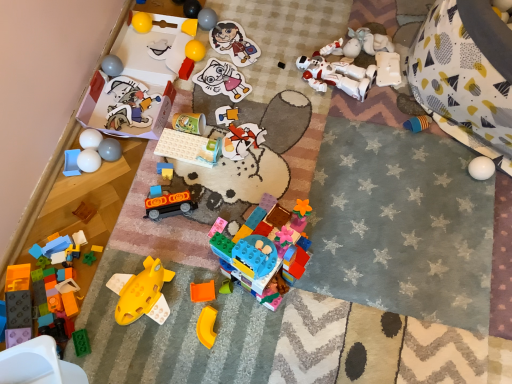
At what (x,y) coordinates should I click in order to perform the action: click on free space that is in between yellow matte block at center, which appears as the 13th toy when viewed from the right, and white plastic robot at upper right, which appears as the second toy when viewed from the right. Please return your answer as a coordinate pair (x, y). The image size is (512, 384). Looking at the image, I should click on (272, 52).